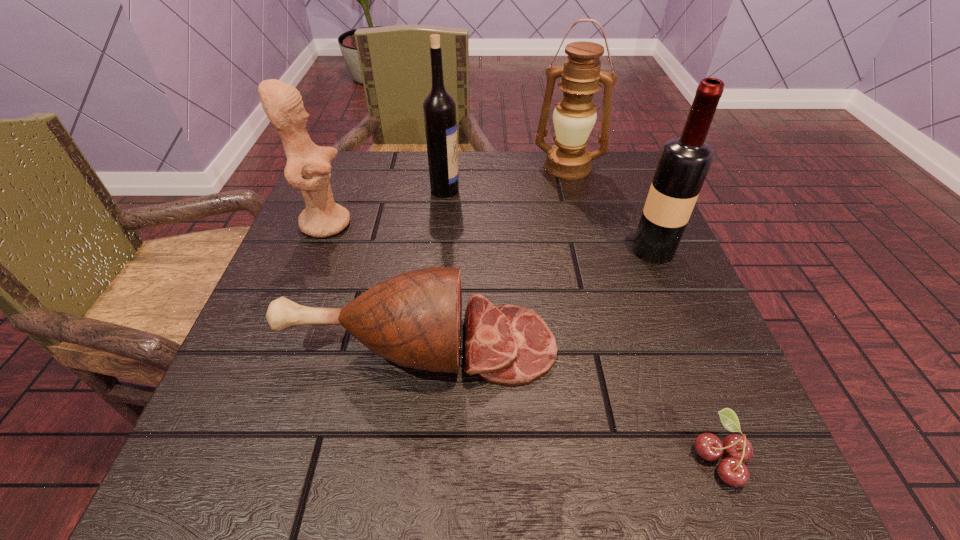
In order to click on free region at the near edge of the desktop in this screenshot , I will do pyautogui.click(x=472, y=455).

Identify the location of blank space at the left edge of the desktop. (231, 393).

Identify the location of vacant space at the right edge. This screenshot has height=540, width=960. (683, 306).

The width and height of the screenshot is (960, 540). Find the location of `vacant area at the far left corner`. vacant area at the far left corner is located at coordinates (345, 205).

Where is `vacant space at the near right corner`? The width and height of the screenshot is (960, 540). vacant space at the near right corner is located at coordinates (711, 502).

Locate an element on the screen. The width and height of the screenshot is (960, 540). free space between the oil lamp and the nearest object is located at coordinates (644, 312).

At what (x,y) coordinates should I click in order to perform the action: click on free space between the right wine bottle and the cherry. Please return your answer as a coordinate pair (x, y). The image size is (960, 540). Looking at the image, I should click on (686, 354).

What are the coordinates of `vacant space that's between the right wine bottle and the oil lamp` in the screenshot? It's located at (611, 209).

The image size is (960, 540). Identify the location of empty location between the figurine and the right wine bottle. (490, 237).

You are a GUI agent. You are given a task and a screenshot of the screen. Output one action in this format:
    pyautogui.click(x=<x>, y=<y>)
    Task: Click on the blank region between the cherry and the fifth nearest object
    
    Given the screenshot: What is the action you would take?
    pyautogui.click(x=583, y=323)